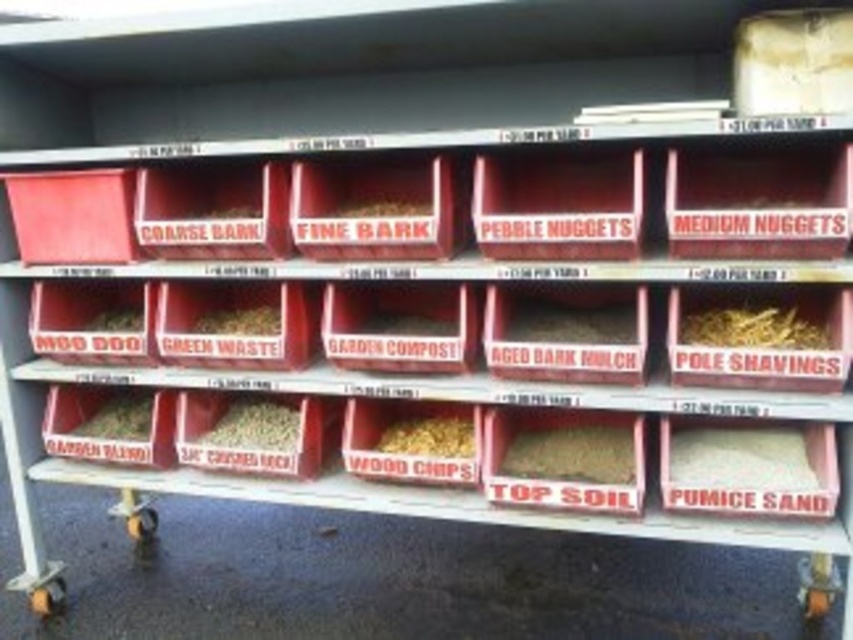
Question: Among these points, which one is farthest from the camera?

Choices:
 (A) (422, 205)
 (B) (281, 451)
 (C) (387, 436)

Answer: (C)

Question: Is brown granular top soil at center further to the viewer compared to brown crumbly mulch at center?

Choices:
 (A) no
 (B) yes

Answer: (A)

Question: Based on their relative distances, which object is nearer to the fine bark at center?

Choices:
 (A) green waste at center
 (B) yellow shredded wood at center right
 (C) brown textured mulch at center
 (D) brown crumbly mulch at center

Answer: (A)

Question: Considering the real-world distances, which object is closest to the brown textured mulch at center?

Choices:
 (A) brown wood chips at center
 (B) brown granular top soil at center

Answer: (A)

Question: Can you confirm if brown granular top soil at center is positioned above brown mulch at center?

Choices:
 (A) yes
 (B) no

Answer: (B)

Question: In this image, where is white granular pumice sand at lower right located relative to brown mulch at center?

Choices:
 (A) right
 (B) left

Answer: (A)